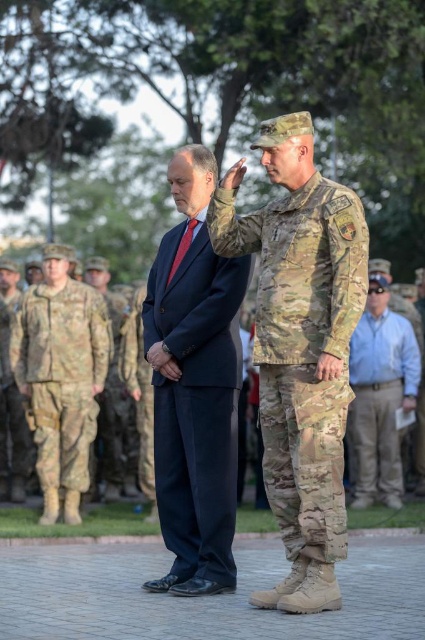
You are a photographer at this military ceremony. You want to take a photo that captures both the camo fabric uniform at right and the camouflage uniform at center. Since you want them to look equally sized in the photo, which uniform should you move closer to the camera?

The camo fabric uniform at right is wider than the camouflage uniform at center, so to make them appear equally sized in the photo, you should move the camouflage uniform at center closer to the camera.

You are a photographer at the ceremony. You need to take a closeup photo of the blue shirt at center and camouflage uniform at center. Which one will appear larger in the photo?

The blue shirt at center will appear larger in the photo because it is bigger than the camouflage uniform at center.